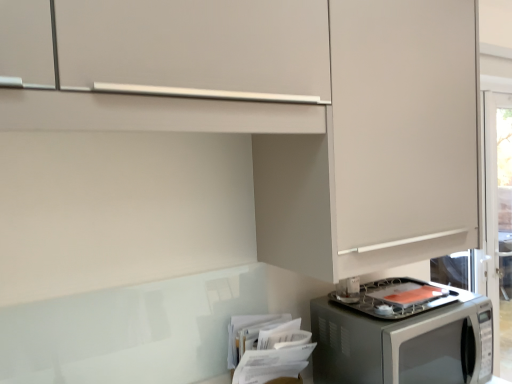
Question: Is matte white cabinet at upper right taller or shorter than satin silver microwave at lower right?

Choices:
 (A) tall
 (B) short

Answer: (A)

Question: Is matte white cabinet at upper right inside or outside of satin silver microwave at lower right?

Choices:
 (A) inside
 (B) outside

Answer: (B)

Question: In terms of size, does matte white cabinet at upper right appear bigger or smaller than satin silver microwave at lower right?

Choices:
 (A) small
 (B) big

Answer: (B)

Question: Is satin silver microwave at lower right situated inside matte white cabinet at upper right or outside?

Choices:
 (A) inside
 (B) outside

Answer: (B)

Question: Considering the positions of satin silver microwave at lower right and matte white cabinet at upper right in the image, is satin silver microwave at lower right bigger or smaller than matte white cabinet at upper right?

Choices:
 (A) small
 (B) big

Answer: (A)

Question: In the image, is satin silver microwave at lower right positioned in front of or behind matte white cabinet at upper right?

Choices:
 (A) behind
 (B) front

Answer: (A)

Question: From a real-world perspective, is satin silver microwave at lower right physically located above or below matte white cabinet at upper right?

Choices:
 (A) below
 (B) above

Answer: (A)